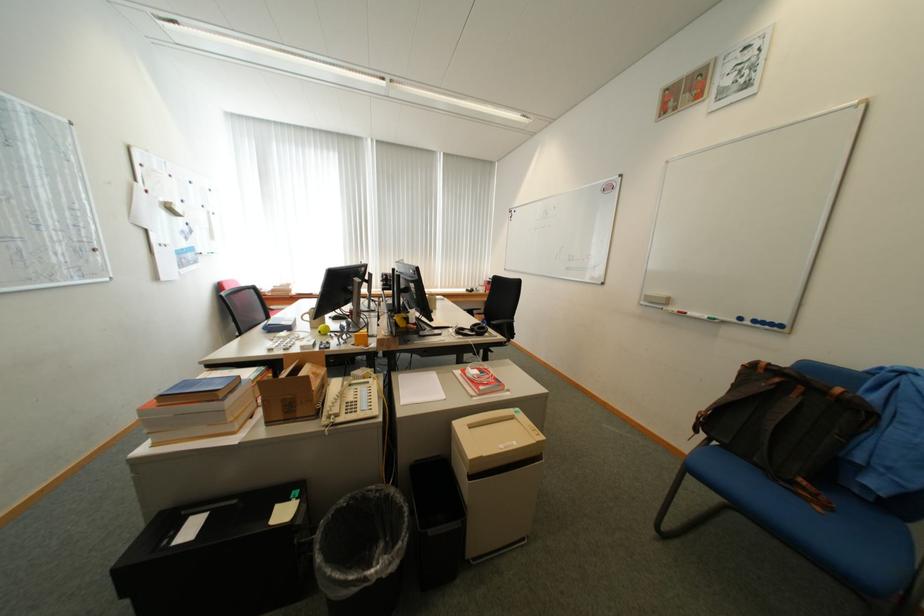
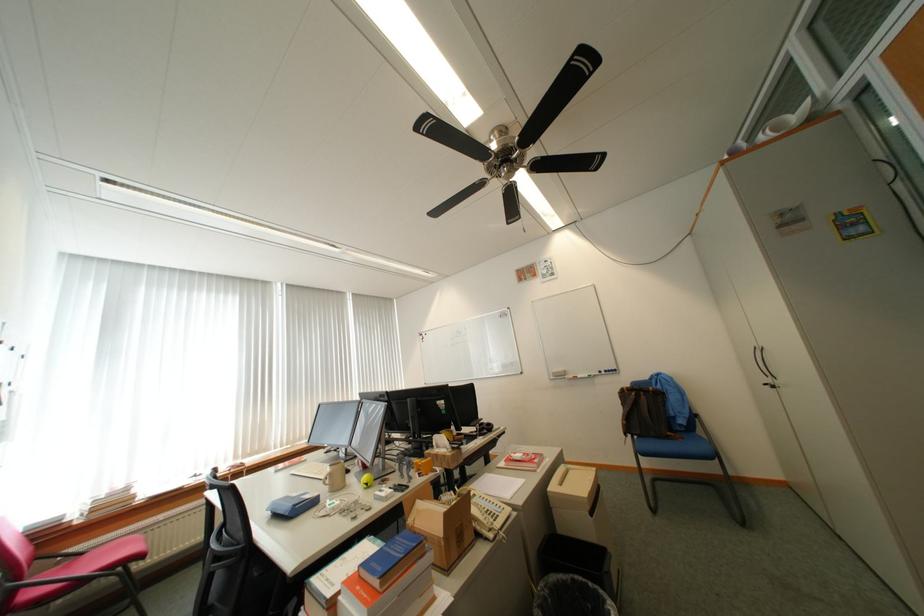
The point at (804,399) is marked in the first image. Where is the corresponding point in the second image?

(652, 399)